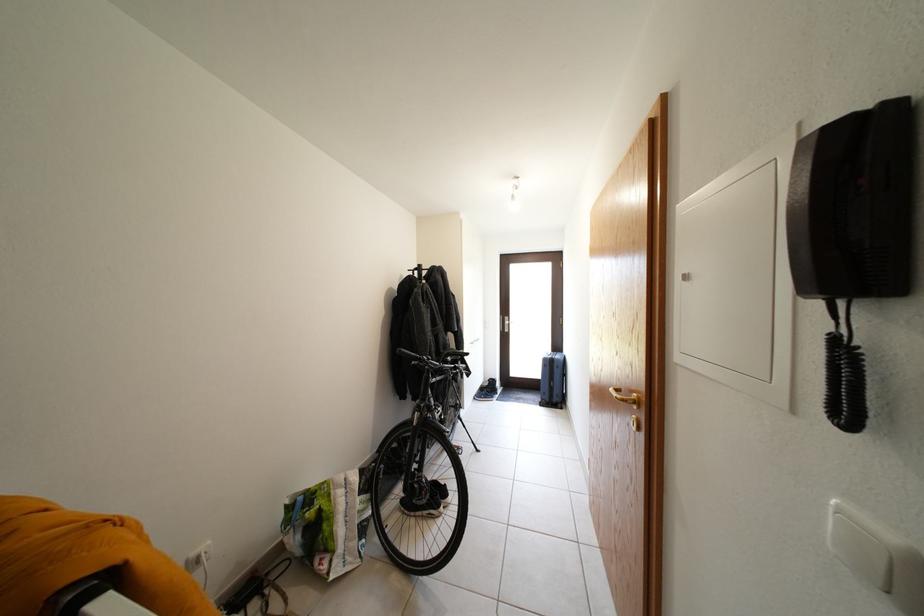
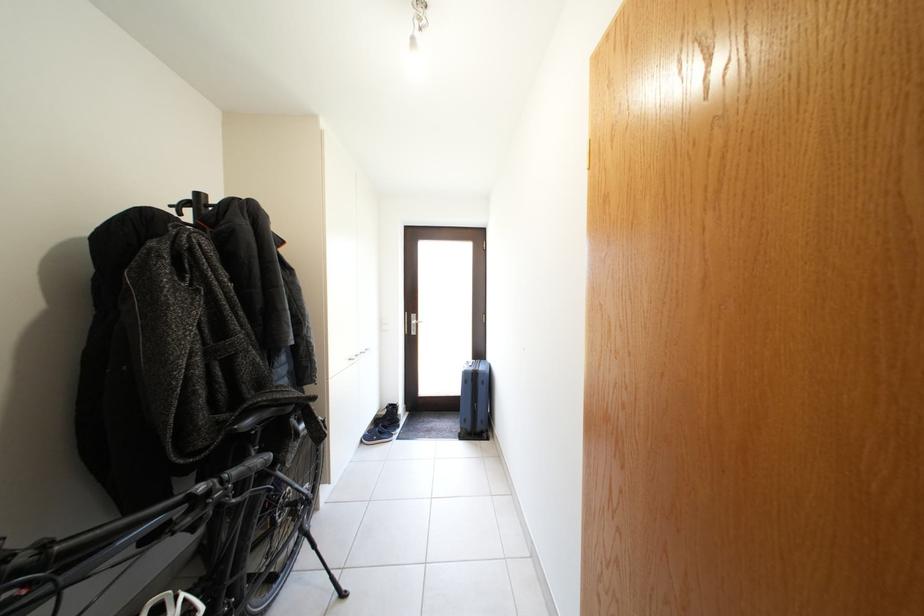
In the second image, find the point that corresponds to pixel 515 323 in the first image.

(421, 322)